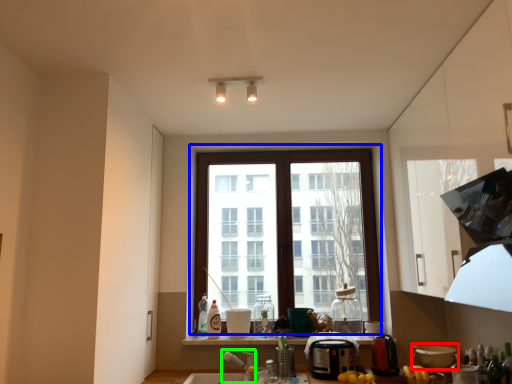
Question: Considering the real-world distances, which object is closest to appliance (highlighted by a red box)? window (highlighted by a blue box) or faucet (highlighted by a green box).

Choices:
 (A) window
 (B) faucet

Answer: (A)